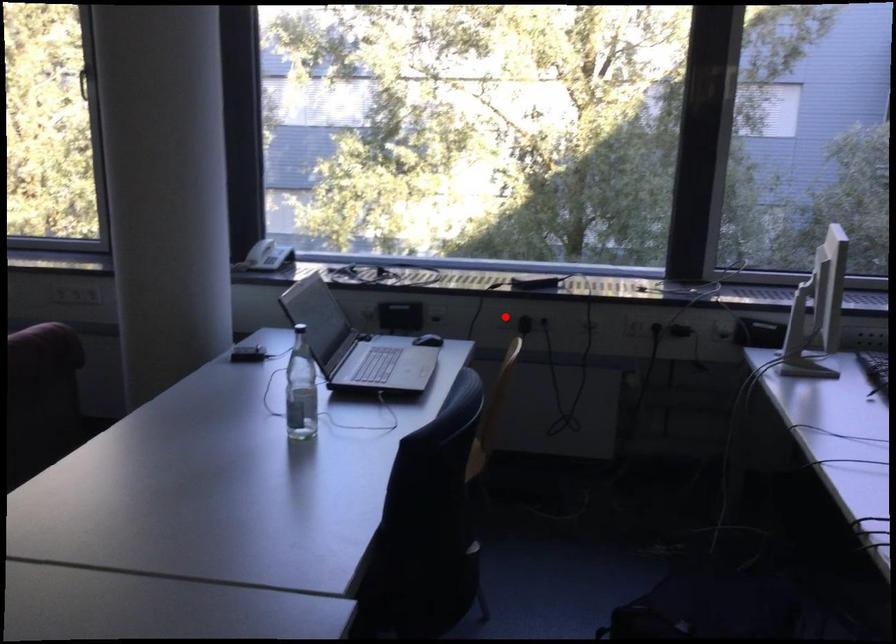
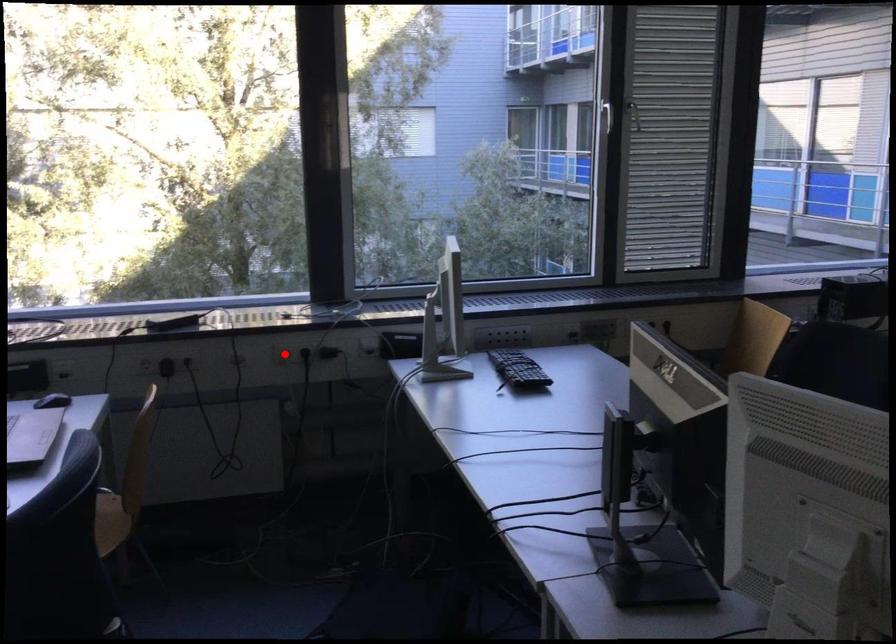
I am providing you with two images of the same scene from different viewpoints. A red point is marked on the first image and another point is marked on the second image. Are the points marked in image1 and image2 representing the same 3D position?

No